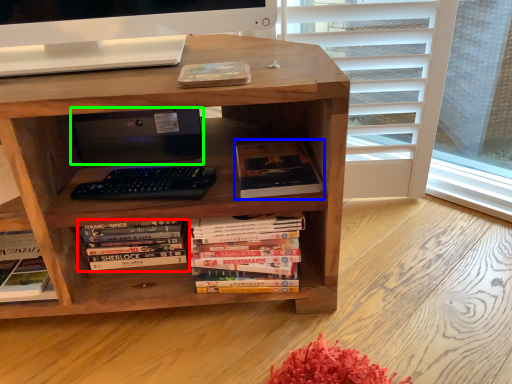
Question: Estimate the real-world distances between objects in this image. Which object is farther from book (highlighted by a red box), book (highlighted by a blue box) or computer (highlighted by a green box)?

Choices:
 (A) book
 (B) computer

Answer: (A)